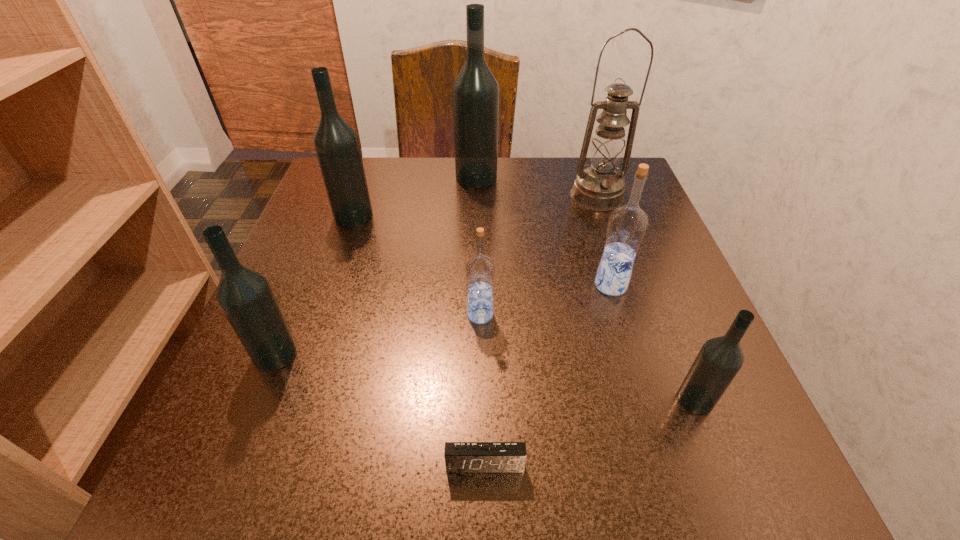
At what (x,y) coordinates should I click in order to perform the action: click on vacant region at the right edge of the desktop. Please return your answer as a coordinate pair (x, y). Looking at the image, I should click on (623, 313).

Where is `free space at the near left corner of the desktop`? The image size is (960, 540). free space at the near left corner of the desktop is located at coordinates (259, 461).

In the image, there is a desktop. At what (x,y) coordinates should I click in order to perform the action: click on vacant space at the far right corner. Please return your answer as a coordinate pair (x, y). The image size is (960, 540). Looking at the image, I should click on (569, 177).

This screenshot has height=540, width=960. I want to click on free space between the oil lamp and the third black vodka from left to right, so click(537, 186).

In order to click on vacant point located between the oil lamp and the smaller blue vodka in this screenshot , I will do `click(539, 255)`.

Locate an element on the screen. This screenshot has height=540, width=960. free spot between the second tallest vodka and the nearest object is located at coordinates (420, 339).

What are the coordinates of `vacant region between the oil lamp and the third nearest object` in the screenshot? It's located at (437, 275).

In order to click on vacant space that's between the third biggest black vodka and the third nearest black vodka in this screenshot , I will do `click(315, 285)`.

You are a GUI agent. You are given a task and a screenshot of the screen. Output one action in this format:
    pyautogui.click(x=<x>, y=<y>)
    Task: Click on the empty space that is in between the nearest object and the second nearest black vodka
    
    Given the screenshot: What is the action you would take?
    pyautogui.click(x=380, y=408)

The image size is (960, 540). What are the coordinates of `vacant area that lies between the nearest vodka and the smaller blue vodka` in the screenshot? It's located at (588, 357).